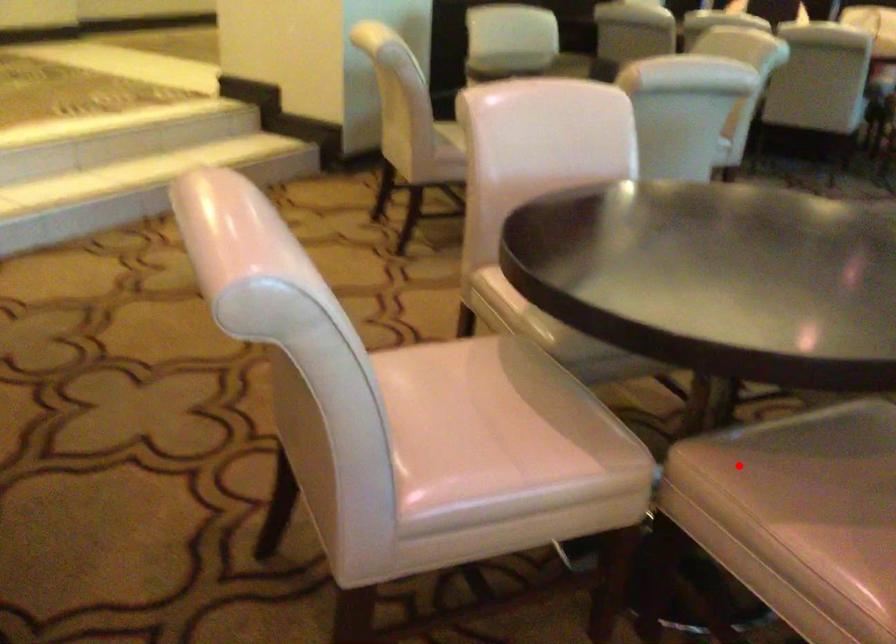
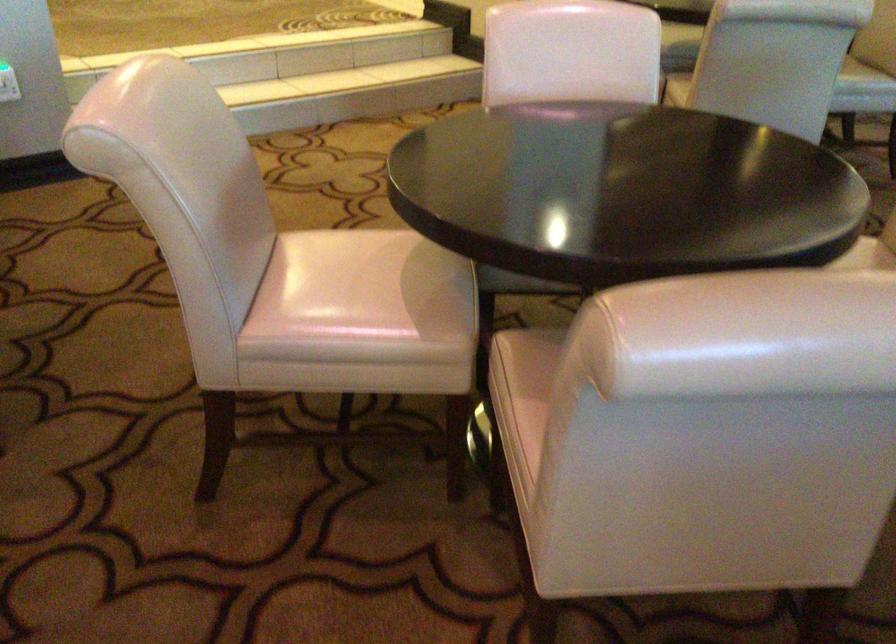
Question: I am providing you with two images of the same scene from different viewpoints. A red point is marked on the first image. At the location where the point appears in image 1, is it still visible in image 2?

Choices:
 (A) Yes
 (B) No

Answer: (A)